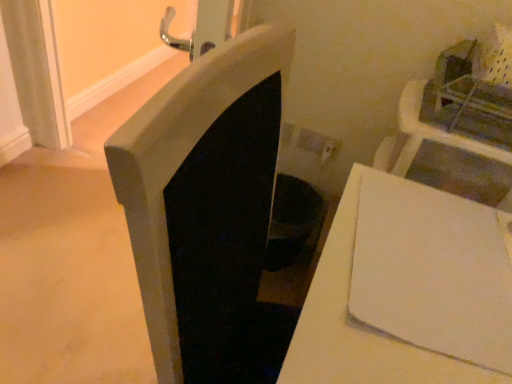
What are the coordinates of `vacant space to the left of black matte fireplace at center` in the screenshot? It's located at (72, 249).